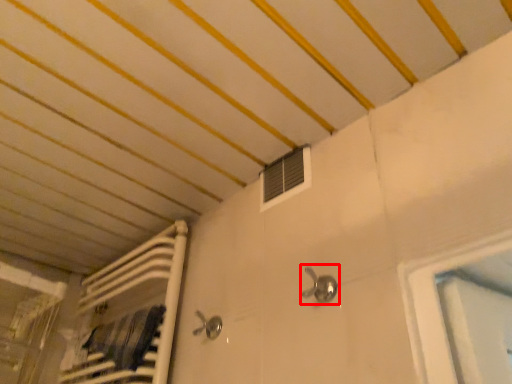
Question: From the image's perspective, considering the relative positions of faucet (annotated by the red box) and air conditioning in the image provided, where is faucet (annotated by the red box) located with respect to the staircase?

Choices:
 (A) above
 (B) below

Answer: (B)